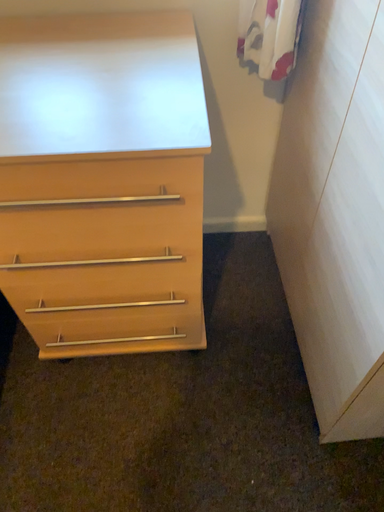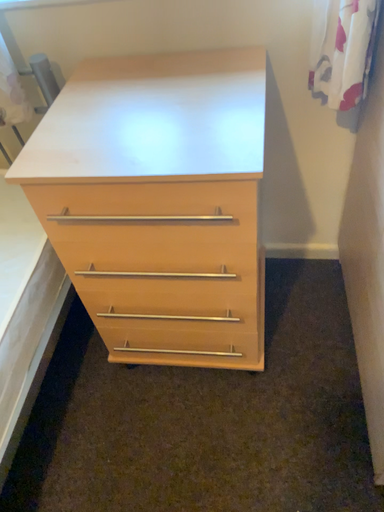
Question: How did the camera likely rotate when shooting the video?

Choices:
 (A) rotated right
 (B) rotated left

Answer: (B)